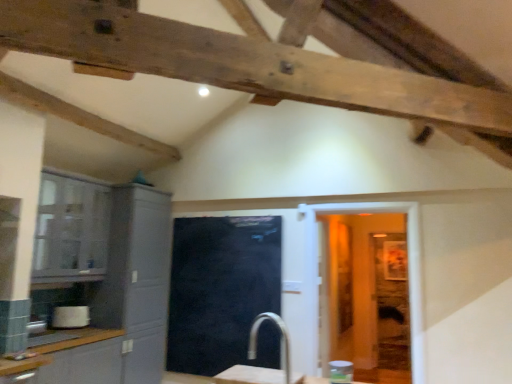
Question: Is white glossy door at center taller than white glossy toaster at lower left, arranged as the first appliance when viewed from the left?

Choices:
 (A) yes
 (B) no

Answer: (A)

Question: Is white glossy door at center thinner than white glossy toaster at lower left, marked as the second appliance in a top-to-bottom arrangement?

Choices:
 (A) no
 (B) yes

Answer: (A)

Question: Does white glossy door at center have a greater width compared to white glossy toaster at lower left, arranged as the first appliance when viewed from the back?

Choices:
 (A) yes
 (B) no

Answer: (A)

Question: Is white glossy door at center to the left of white glossy toaster at lower left, acting as the 2th appliance starting from the right, from the viewer's perspective?

Choices:
 (A) no
 (B) yes

Answer: (A)

Question: From a real-world perspective, is white glossy door at center beneath white glossy toaster at lower left, which appears as the second appliance when viewed from the front?

Choices:
 (A) yes
 (B) no

Answer: (B)

Question: Can you see white glossy door at center touching white glossy toaster at lower left, the 1th appliance in the bottom-to-top sequence?

Choices:
 (A) no
 (B) yes

Answer: (A)

Question: Does clear plastic jar at lower right, arranged as the 2th appliance when ordered from the bottom, have a greater width compared to black glass door at center?

Choices:
 (A) no
 (B) yes

Answer: (B)

Question: Is clear plastic jar at lower right, arranged as the 1th appliance when viewed from the right, in contact with black glass door at center?

Choices:
 (A) no
 (B) yes

Answer: (A)

Question: Is clear plastic jar at lower right, which is the 2th appliance in back-to-front order, oriented towards black glass door at center?

Choices:
 (A) no
 (B) yes

Answer: (A)

Question: Considering the relative sizes of clear plastic jar at lower right, arranged as the 2th appliance when ordered from the bottom, and black glass door at center in the image provided, is clear plastic jar at lower right, arranged as the 2th appliance when ordered from the bottom, taller than black glass door at center?

Choices:
 (A) yes
 (B) no

Answer: (B)

Question: From a real-world perspective, is clear plastic jar at lower right, the first appliance in the top-to-bottom sequence, physically below black glass door at center?

Choices:
 (A) yes
 (B) no

Answer: (A)

Question: Are matte gray cabinet at left, positioned as the first cabinetry in back-to-front order, and black glass door at center located far from each other?

Choices:
 (A) no
 (B) yes

Answer: (A)